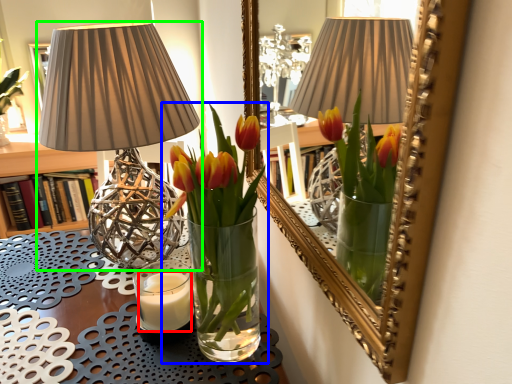
Question: Based on their relative distances, which object is farther from candle (highlighted by a red box)? Choose from houseplant (highlighted by a blue box) and lamp (highlighted by a green box).

Choices:
 (A) houseplant
 (B) lamp

Answer: (B)